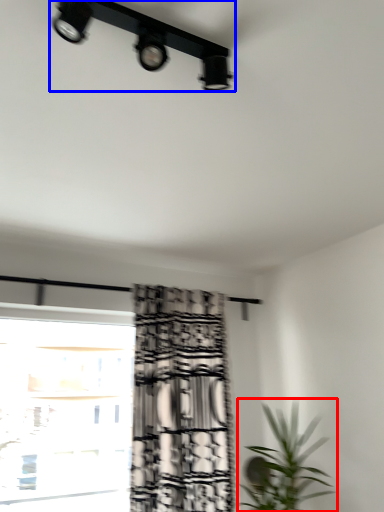
Question: Which of the following is the farthest to the observer, houseplant (highlighted by a red box) or lamp (highlighted by a blue box)?

Choices:
 (A) houseplant
 (B) lamp

Answer: (A)